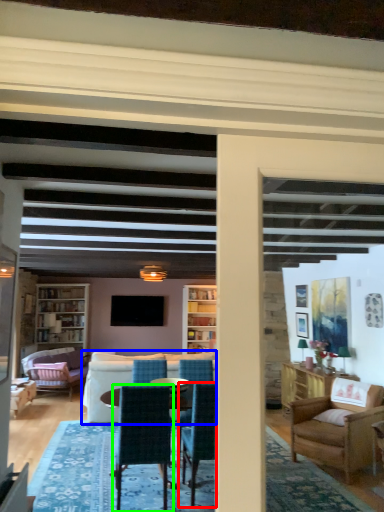
Question: Based on their relative distances, which object is nearer to chair (highlighted by a red box)? Choose from studio couch (highlighted by a blue box) and chair (highlighted by a green box).

Choices:
 (A) studio couch
 (B) chair

Answer: (B)